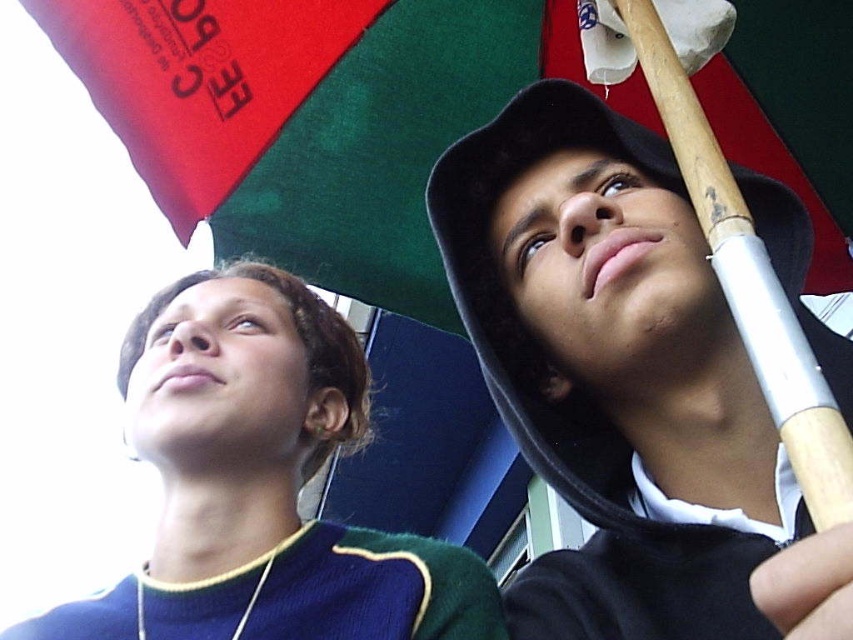
Question: Among these objects, which one is farthest from the camera?

Choices:
 (A) wooden baseball bat at right
 (B) green fabric umbrella at upper center
 (C) dark blue sweater at upper left
 (D) black matte baseball cap at upper center

Answer: (B)

Question: Is black matte baseball cap at upper center in front of wooden baseball bat at right?

Choices:
 (A) no
 (B) yes

Answer: (A)

Question: Based on their relative distances, which object is farther from the wooden baseball bat at right?

Choices:
 (A) black matte baseball cap at upper center
 (B) green fabric umbrella at upper center
 (C) dark blue sweater at upper left

Answer: (C)

Question: Does black matte baseball cap at upper center come behind green fabric umbrella at upper center?

Choices:
 (A) yes
 (B) no

Answer: (B)

Question: Is green fabric umbrella at upper center thinner than dark blue sweater at upper left?

Choices:
 (A) yes
 (B) no

Answer: (B)

Question: Which object is farther from the camera taking this photo?

Choices:
 (A) dark blue sweater at upper left
 (B) black matte baseball cap at upper center
 (C) green fabric umbrella at upper center

Answer: (C)